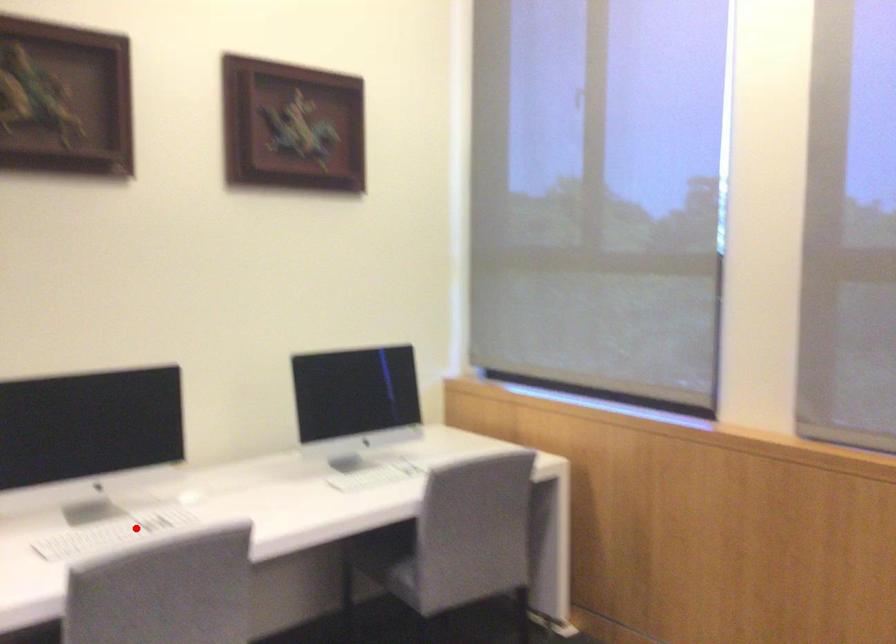
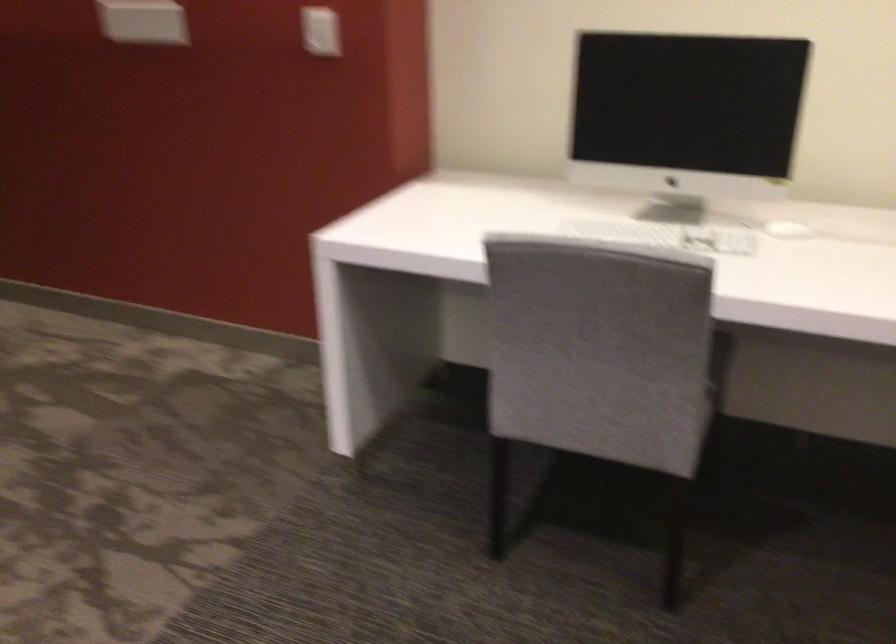
Question: I am providing you with two images of the same scene from different viewpoints. In image1, a red point is highlighted. Considering the same 3D point in image2, which of the following is correct?

Choices:
 (A) It is closer
 (B) It is farther

Answer: (A)